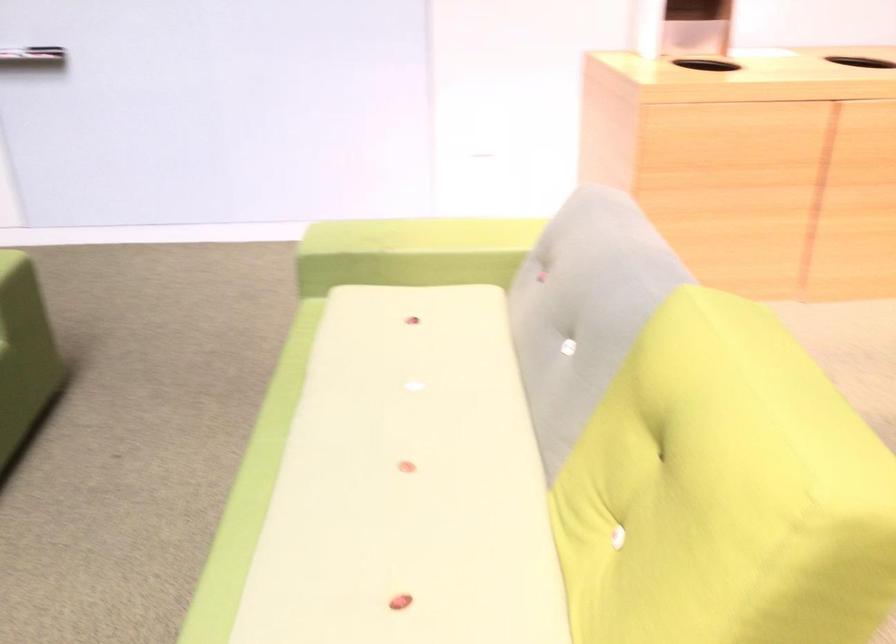
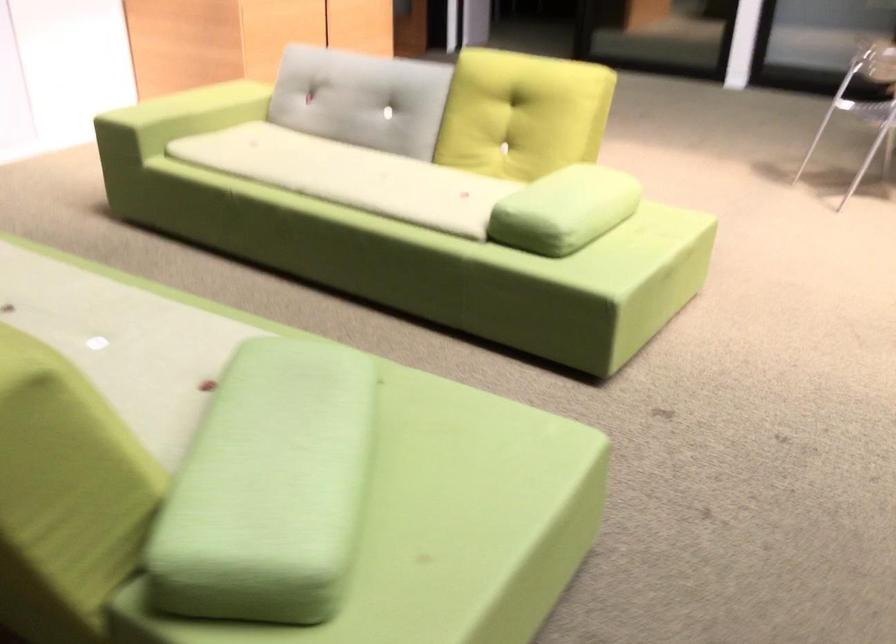
Find the pixel in the second image that matches pixel 349 261 in the first image.

(178, 117)